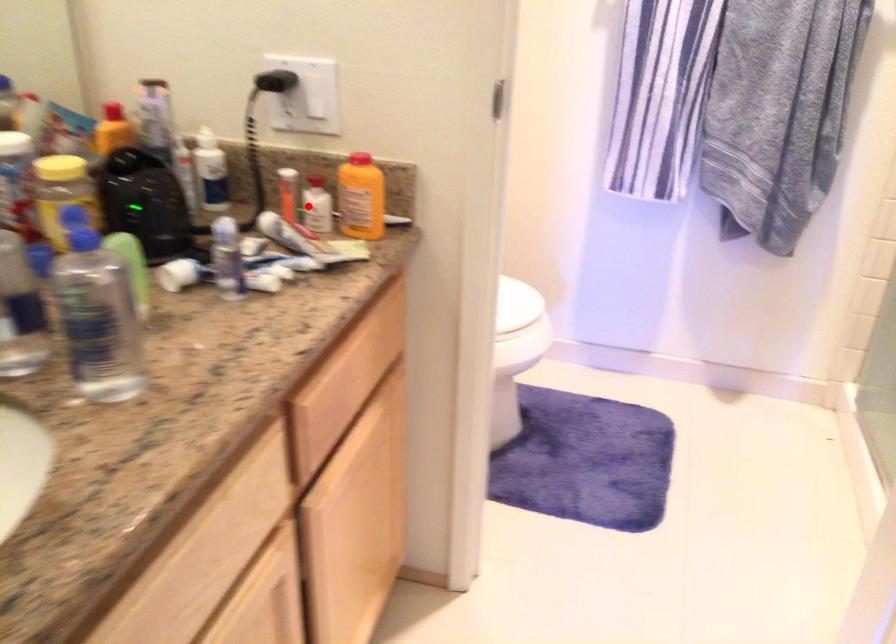
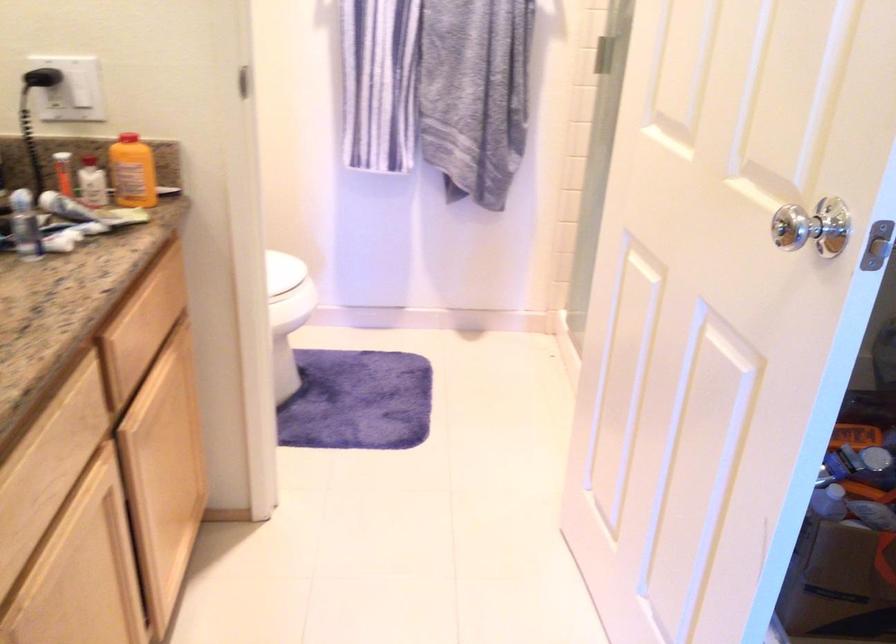
Question: I am providing you with two images of the same scene from different viewpoints. Image1 has a red point marked. In image2, the corresponding 3D location appears at what relative position? Reply with the corresponding letter.

Choices:
 (A) Closer
 (B) Farther

Answer: (B)